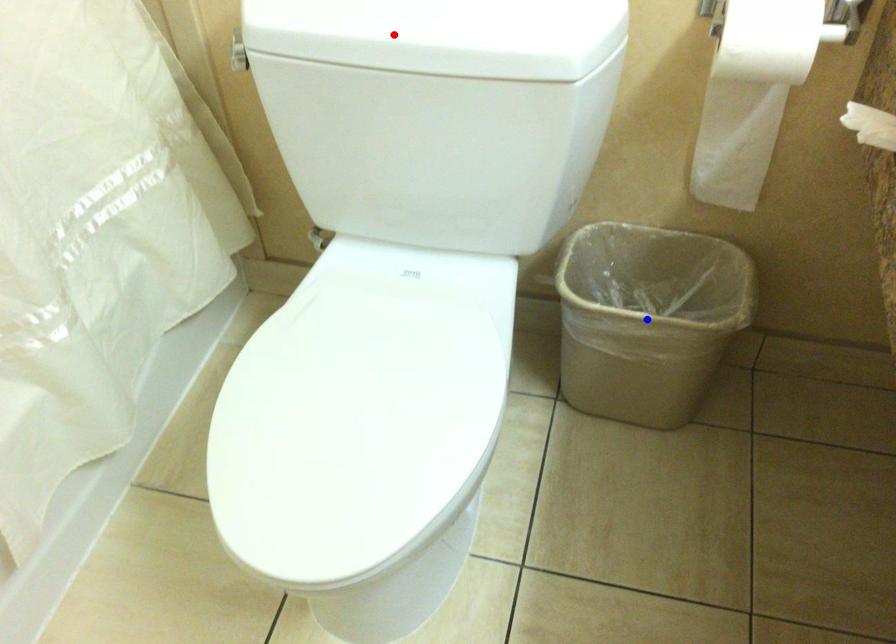
Question: Two points are marked on the image. Which point is closer to the camera?

Choices:
 (A) Blue point is closer.
 (B) Red point is closer.

Answer: (B)